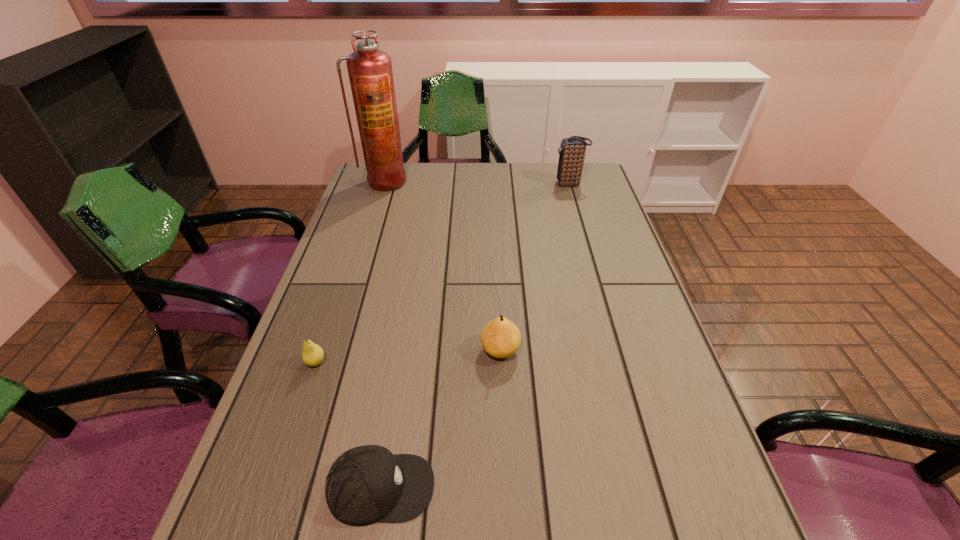
Identify the location of fire extinguisher. (370, 72).

At what (x,y) coordinates should I click in order to perform the action: click on clutch bag. Please return your answer as a coordinate pair (x, y). This screenshot has height=540, width=960. Looking at the image, I should click on (572, 151).

In order to click on the fourth shortest object in this screenshot , I will do `click(572, 151)`.

This screenshot has width=960, height=540. What are the coordinates of `the third shortest object` in the screenshot? It's located at (500, 338).

Where is `the second object from right to left`? The width and height of the screenshot is (960, 540). the second object from right to left is located at coordinates (500, 338).

I want to click on the left pear, so click(312, 354).

What are the coordinates of `cap` in the screenshot? It's located at (367, 484).

Where is `vacant space located on the side of the fire extinguisher with the label`? The image size is (960, 540). vacant space located on the side of the fire extinguisher with the label is located at coordinates (375, 209).

Image resolution: width=960 pixels, height=540 pixels. I want to click on free space located 0.180m with the zip open on the clutch bag, so click(502, 184).

Locate an element on the screen. This screenshot has width=960, height=540. free region located 0.170m with the zip open on the clutch bag is located at coordinates (505, 184).